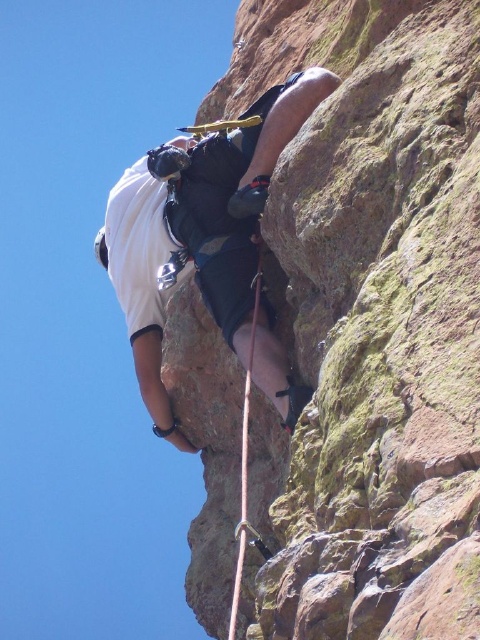
Does rusty rock at center appear under white matte climbing harness at center?

Correct, rusty rock at center is located below white matte climbing harness at center.

Does rusty rock at center appear on the right side of white matte climbing harness at center?

Indeed, rusty rock at center is positioned on the right side of white matte climbing harness at center.

Is point (447, 168) positioned behind point (119, 243)?

No.

The width and height of the screenshot is (480, 640). In order to click on rusty rock at center in this screenshot , I will do `click(370, 323)`.

Who is higher up, white matte climbing harness at center or orange nylon rope at center?

white matte climbing harness at center is higher up.

Which is behind, point (100, 262) or point (243, 460)?

The point (100, 262) is more distant.

Locate an element on the screen. white matte climbing harness at center is located at coordinates (199, 228).

Does rusty rock at center have a larger size compared to orange nylon rope at center?

Yes.

Who is taller, rusty rock at center or orange nylon rope at center?

Standing taller between the two is rusty rock at center.

Is point (431, 136) positioned behind point (240, 529)?

No, (431, 136) is closer to viewer.

You are a GUI agent. You are given a task and a screenshot of the screen. Output one action in this format:
    pyautogui.click(x=<x>, y=<y>)
    Task: Click on the rusty rock at center
    The width and height of the screenshot is (480, 640).
    Given the screenshot: What is the action you would take?
    pyautogui.click(x=370, y=323)